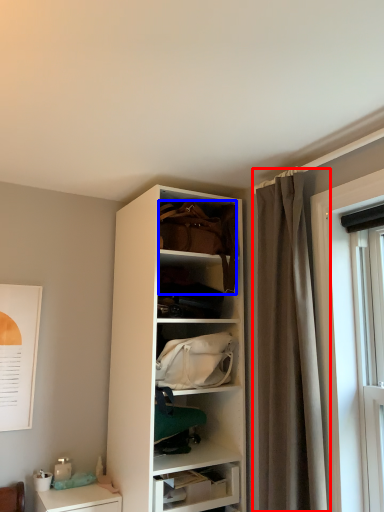
Question: Which object is further to the camera taking this photo, curtain (highlighted by a red box) or handbag (highlighted by a blue box)?

Choices:
 (A) curtain
 (B) handbag

Answer: (B)